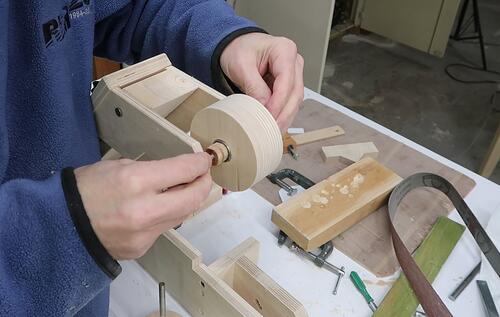
Where is `concrete floor`? This screenshot has width=500, height=317. concrete floor is located at coordinates (413, 116).